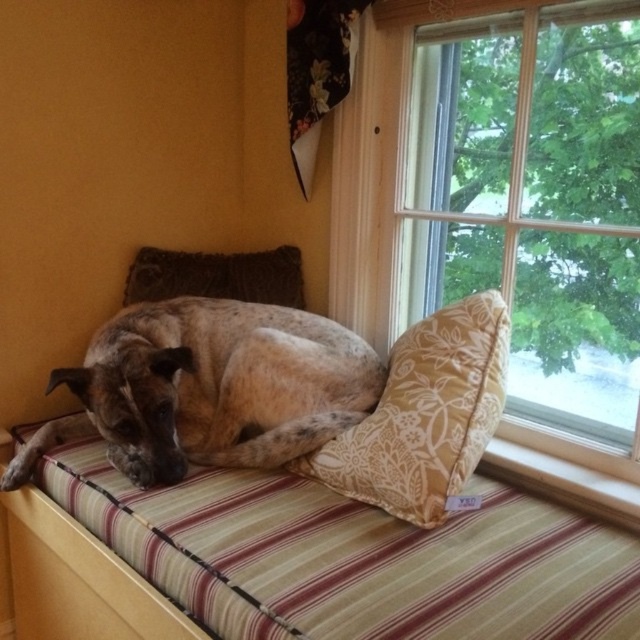
Question: Can you confirm if transparent glass window at upper right is thinner than striped fabric dog bed at center?

Choices:
 (A) no
 (B) yes

Answer: (B)

Question: Is speckled fur dog at center further to camera compared to velvety brown pillow at upper center?

Choices:
 (A) no
 (B) yes

Answer: (A)

Question: Which point is closer to the camera taking this photo?

Choices:
 (A) (548, 451)
 (B) (470, 436)

Answer: (B)

Question: Is speckled fur dog at center behind velvety brown pillow at upper center?

Choices:
 (A) no
 (B) yes

Answer: (A)

Question: Which object appears farthest from the camera in this image?

Choices:
 (A) transparent glass window at upper right
 (B) floral fabric pillow at center

Answer: (A)

Question: Which is nearer to the speckled fur dog at center?

Choices:
 (A) striped fabric dog bed at center
 (B) floral fabric pillow at center

Answer: (A)